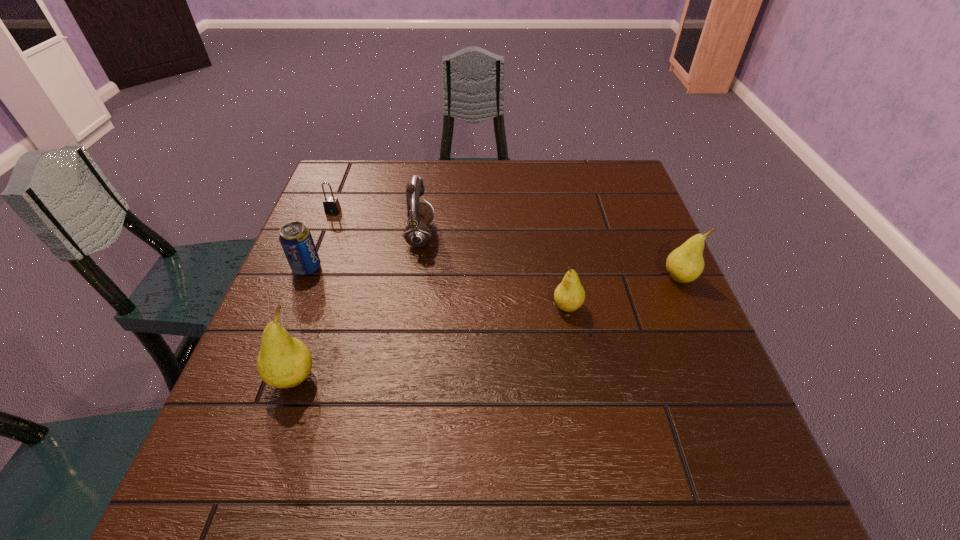
If the aim is uniform spacing by inserting an additional pear among them, please point to a vacant space for this new pear. Please provide its 2D coordinates. Your answer should be formatted as a tuple, i.e. [(x, y)], where the tuple contains the x and y coordinates of a point satisfying the conditions above.

[(440, 341)]